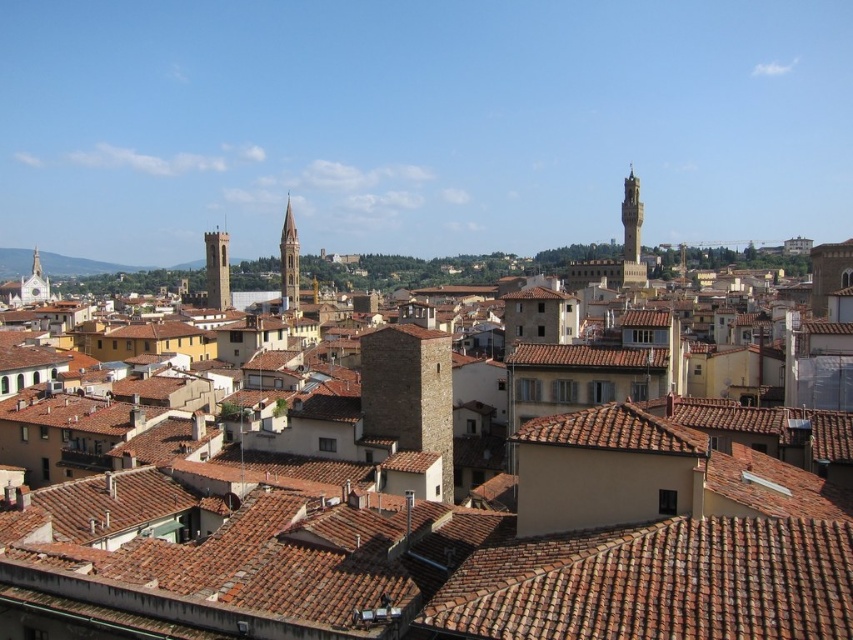
You are standing at the point marked by the coordinates point (631, 232) in a historic cityscape. What structure are you standing on?

The point (631, 232) marks the golden stone tower at upper right, so you are standing on the golden stone tower at upper right.

You are an architect analyzing the city layout. Looking at the image, which object is positioned to the right of the other between the brown tile roof at center and the white stone tower at left?

The brown tile roof at center is to the right of the white stone tower at left according to the description.